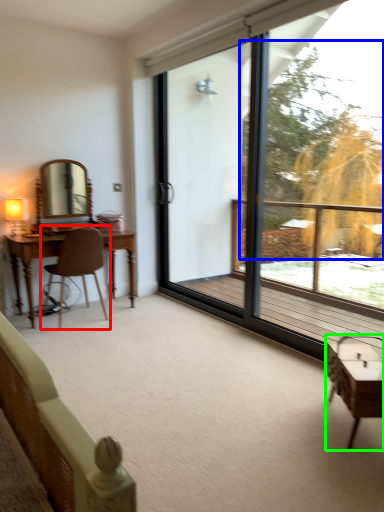
Question: Based on their relative distances, which object is farther from chair (highlighted by a red box)? Choose from tree (highlighted by a blue box) and table (highlighted by a green box).

Choices:
 (A) tree
 (B) table

Answer: (A)